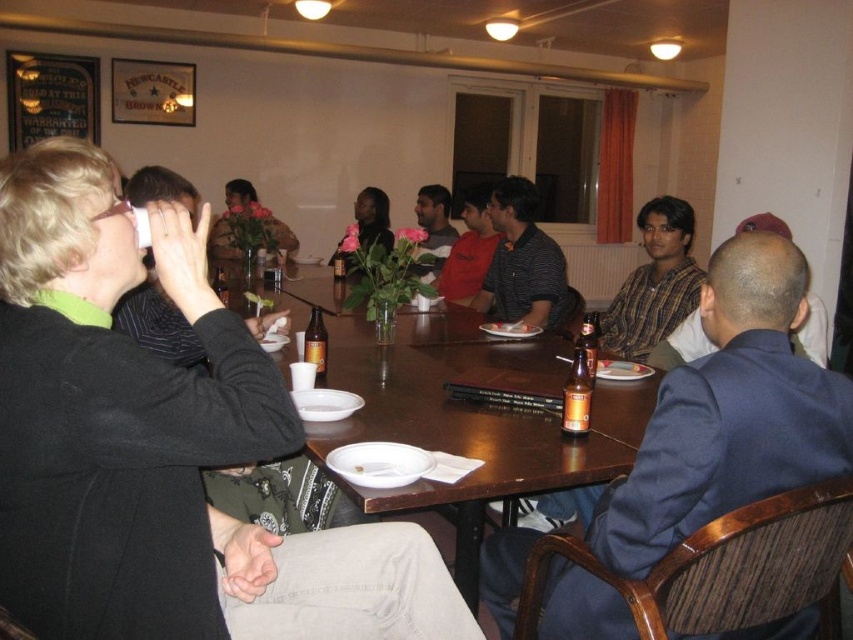
Who is more forward, (738, 355) or (432, 237)?

Point (738, 355)

Does blue suit jacket at center appear on the left side of matte black shirt at center?

Incorrect, blue suit jacket at center is not on the left side of matte black shirt at center.

Who is more distant from viewer, (740, 285) or (427, 188)?

The point (427, 188) is more distant.

This screenshot has width=853, height=640. Find the location of `blue suit jacket at center`. blue suit jacket at center is located at coordinates (729, 413).

Is checkered shirt at center smaller than matte black shirt at center?

Indeed, checkered shirt at center has a smaller size compared to matte black shirt at center.

Does checkered shirt at center appear over matte black shirt at center?

No, checkered shirt at center is not above matte black shirt at center.

Measure the distance between point (679, 330) and camera.

The distance of point (679, 330) from camera is 9.36 feet.

Where is `checkered shirt at center`? The height and width of the screenshot is (640, 853). checkered shirt at center is located at coordinates (682, 344).

In the scene shown: Does brown wooden table at center have a larger size compared to brown glass bottle at table center?

Yes.

Who is more forward, (495, 429) or (311, 337)?

Point (495, 429) is in front.

Identify the location of brown wooden table at center. (x=473, y=422).